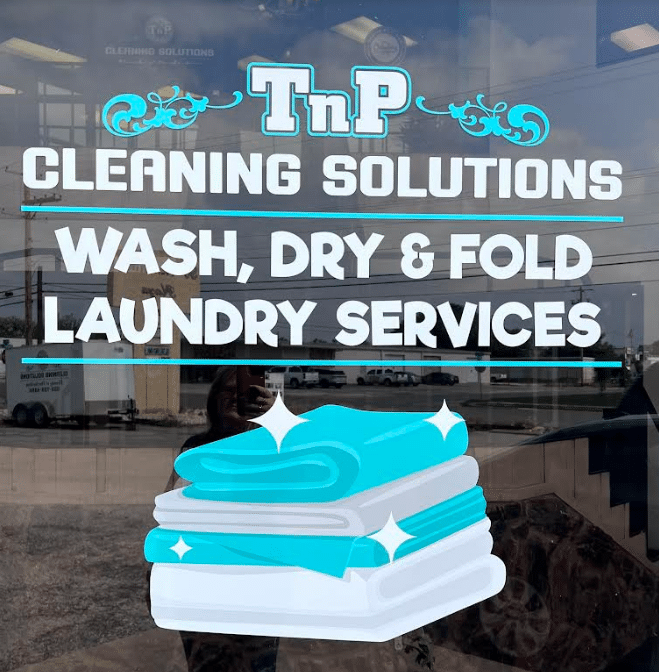
Identify the location of hand towel. The width and height of the screenshot is (659, 672). (312, 460).